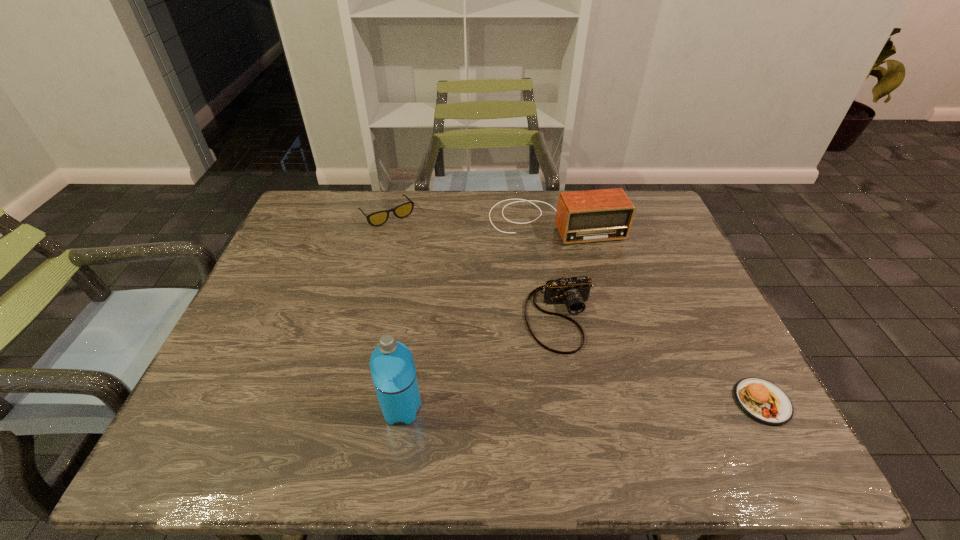
Find the location of a particular element. Image resolution: width=960 pixels, height=540 pixels. vacant spot on the desktop that is between the fourth object from right to left and the rightmost object and is positioned on the front-facing side of the third tallest object is located at coordinates (588, 405).

The width and height of the screenshot is (960, 540). Find the location of `free space on the desktop that is between the thermos bottle and the rightmost object and is positioned on the front-facing side of the leftmost object`. free space on the desktop that is between the thermos bottle and the rightmost object and is positioned on the front-facing side of the leftmost object is located at coordinates (538, 406).

What are the coordinates of `vacant space on the desktop that is between the thermos bottle and the rightmost object and is positioned on the front-facing side of the radio receiver` in the screenshot? It's located at (634, 404).